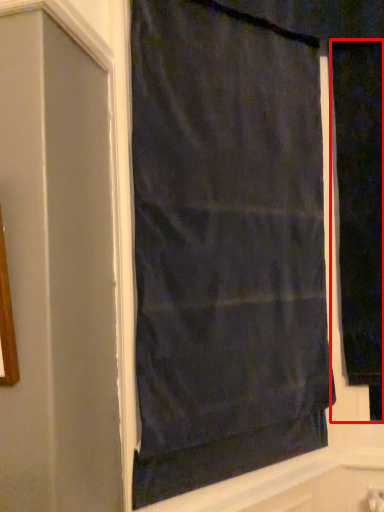
Question: From the image's perspective, considering the relative positions of curtain (annotated by the red box) and curtain in the image provided, where is curtain (annotated by the red box) located with respect to the staircase?

Choices:
 (A) above
 (B) below

Answer: (A)